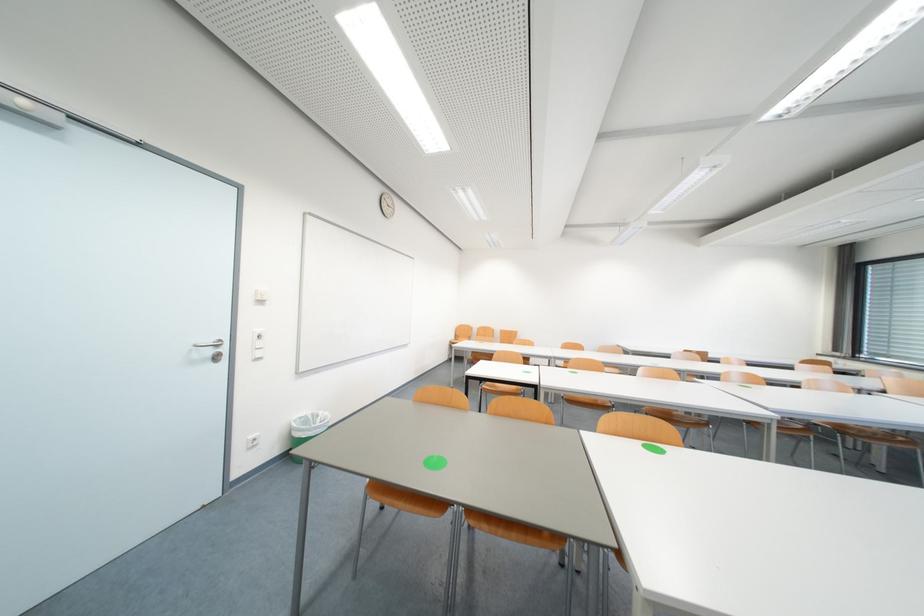
This screenshot has width=924, height=616. Describe the element at coordinates (210, 344) in the screenshot. I see `the silver door handle` at that location.